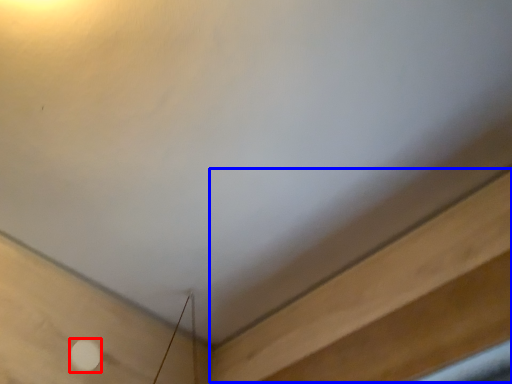
Question: Which object is closer to the camera taking this photo, dot (highlighted by a red box) or plywood (highlighted by a blue box)?

Choices:
 (A) dot
 (B) plywood

Answer: (B)